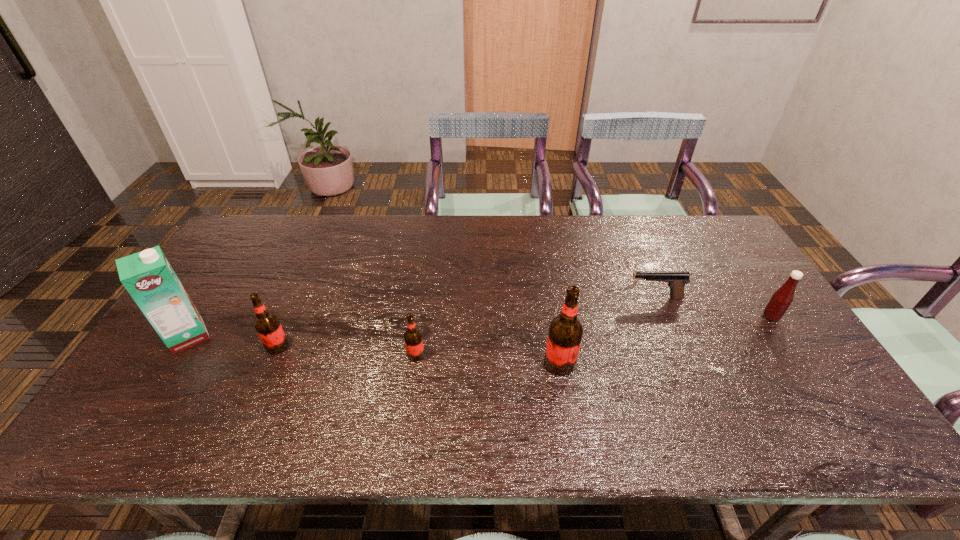
Identify the location of the leftmost root beer. The width and height of the screenshot is (960, 540). (267, 324).

At what (x,y) coordinates should I click in order to perform the action: click on the second shortest root beer. Please return your answer as a coordinate pair (x, y). Image resolution: width=960 pixels, height=540 pixels. Looking at the image, I should click on (267, 324).

I want to click on the second root beer from right to left, so click(413, 339).

At what (x,y) coordinates should I click in order to perform the action: click on the shortest root beer. Please return your answer as a coordinate pair (x, y). This screenshot has height=540, width=960. Looking at the image, I should click on coord(413,339).

Identify the location of the fourth object from left to right. (565, 333).

At what (x,y) coordinates should I click in order to perform the action: click on the rightmost root beer. Please return your answer as a coordinate pair (x, y). This screenshot has width=960, height=540. Looking at the image, I should click on (565, 333).

I want to click on Tabasco sauce, so click(780, 301).

You are a GUI agent. You are given a task and a screenshot of the screen. Output one action in this format:
    pyautogui.click(x=<x>, y=<y>)
    Task: Click on the pistol
    Image resolution: width=960 pixels, height=540 pixels.
    Given the screenshot: What is the action you would take?
    pyautogui.click(x=676, y=281)

Find the location of `the fifth object from left to right`. the fifth object from left to right is located at coordinates (676, 281).

What are the coordinates of `the leftmost object` in the screenshot? It's located at (149, 278).